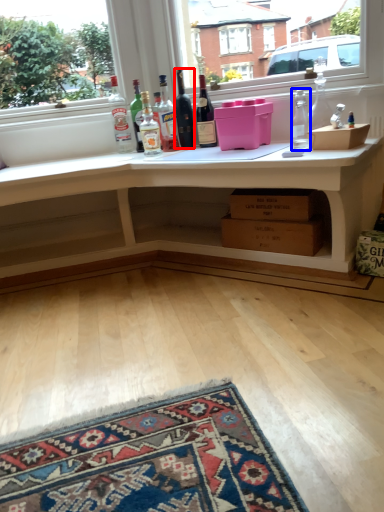
Question: Which object appears closest to the camera in this image, bottle (highlighted by a red box) or bottle (highlighted by a blue box)?

Choices:
 (A) bottle
 (B) bottle

Answer: (B)